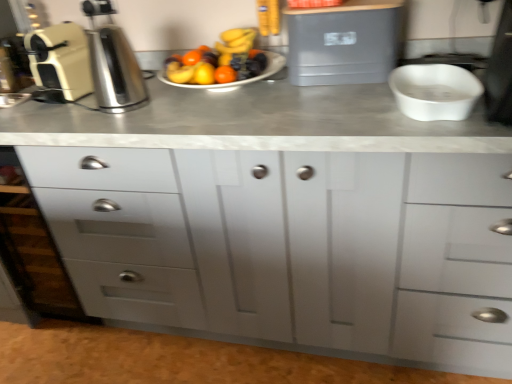
You are a GUI agent. You are given a task and a screenshot of the screen. Output one action in this format:
    pyautogui.click(x=<x>, y=<y>)
    Task: Click on the vacant region in front of gray plastic container at upper center, the 1th appliance positioned from the right
    
    Given the screenshot: What is the action you would take?
    pyautogui.click(x=329, y=102)